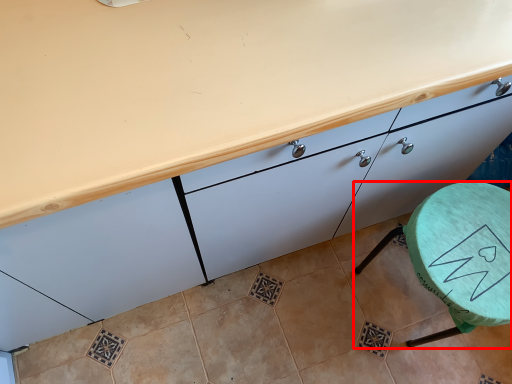
Question: Observing the image, what is the correct spatial positioning of furniture (annotated by the red box) in reference to cabinetry?

Choices:
 (A) left
 (B) right

Answer: (B)